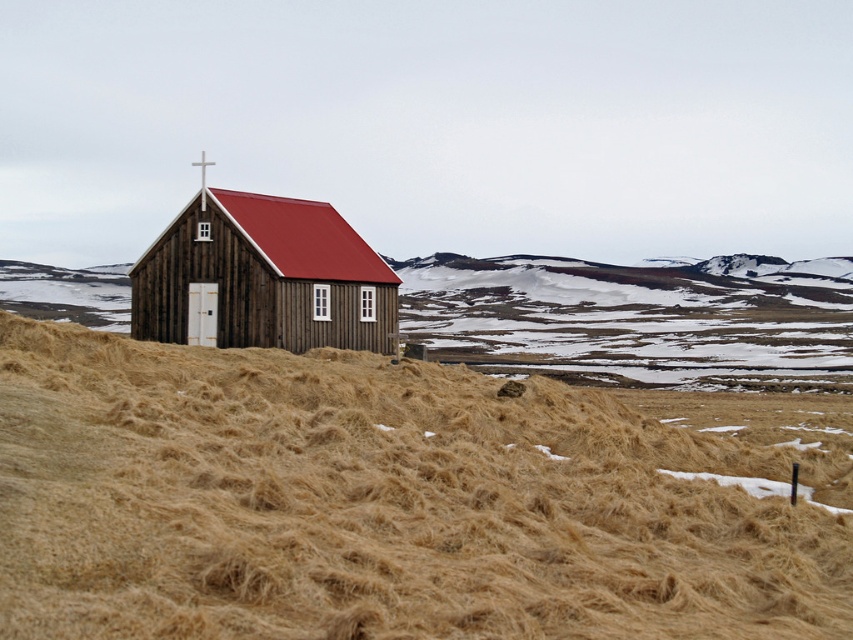
You are a photographer planning to capture the wooden chapel at center and the brown dry grass at lower center in a single shot. Based on the scene description, which object will occupy more space in the photo?

The brown dry grass at lower center will occupy more space in the photo because it is bigger than the wooden chapel at center according to the description.

You are standing in the field and want to walk towards the wooden chapel at center. Which direction should you move relative to the brown dry grass at lower center?

You should move to the left of the brown dry grass at lower center to reach the wooden chapel at center, since the chapel is to the left of the grass.